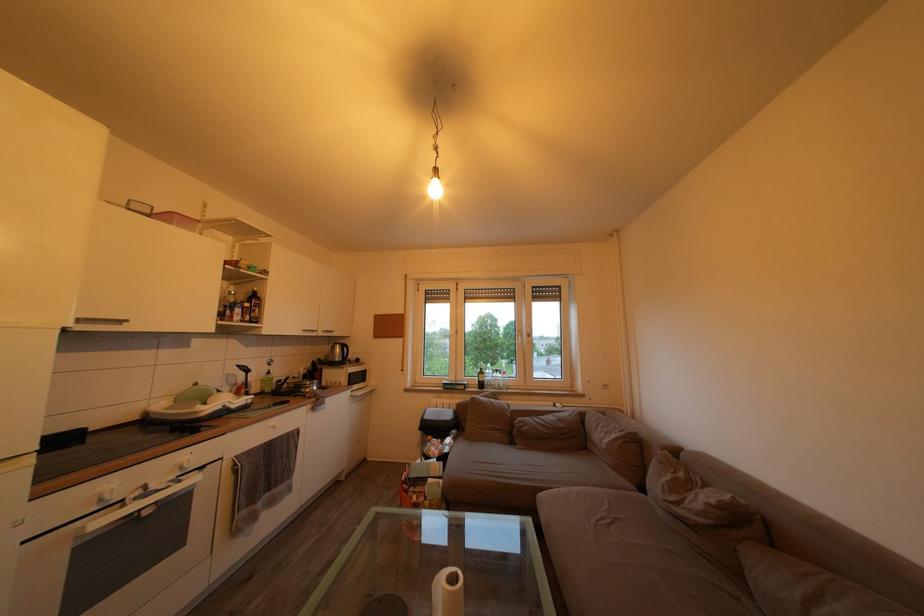
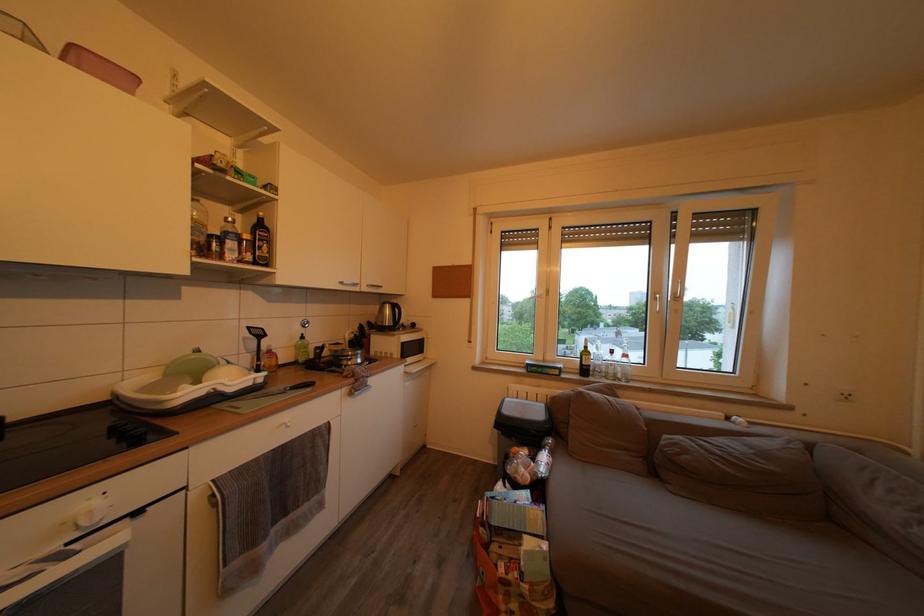
The point at (283, 434) is marked in the first image. Where is the corresponding point in the second image?

(296, 432)